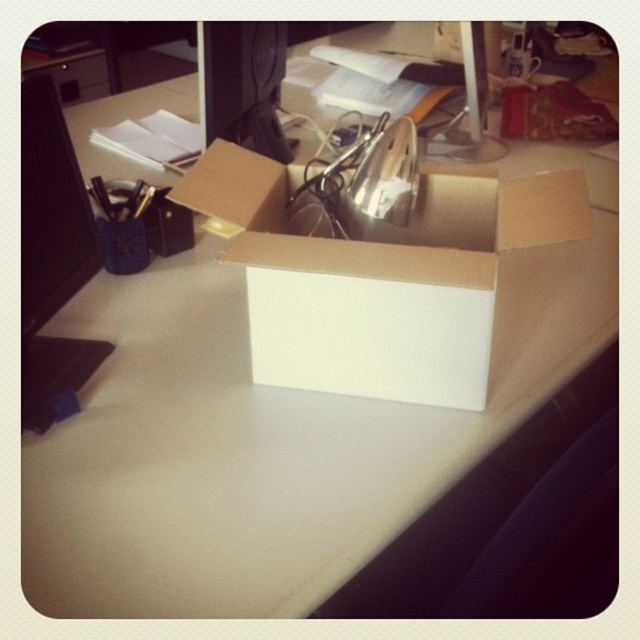
Question: Is black glossy computer monitor at left smaller than matte black monitor at upper center?

Choices:
 (A) no
 (B) yes

Answer: (B)

Question: Which of these objects is positioned farthest from the brown cardboard box at center?

Choices:
 (A) matte black monitor at upper center
 (B) black glossy computer monitor at left

Answer: (A)

Question: Estimate the real-world distances between objects in this image. Which object is farther from the matte black monitor at upper center?

Choices:
 (A) brown cardboard box at center
 (B) black glossy computer monitor at left

Answer: (B)

Question: Among these points, which one is nearest to the camera?

Choices:
 (A) (45, 339)
 (B) (269, 60)

Answer: (A)

Question: Is black glossy computer monitor at left thinner than matte black monitor at upper center?

Choices:
 (A) yes
 (B) no

Answer: (A)

Question: Does brown cardboard box at center have a greater width compared to matte black monitor at upper center?

Choices:
 (A) yes
 (B) no

Answer: (A)